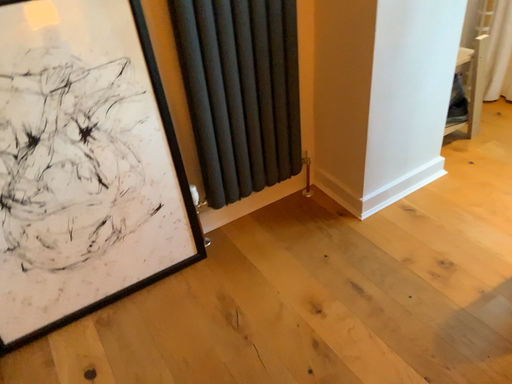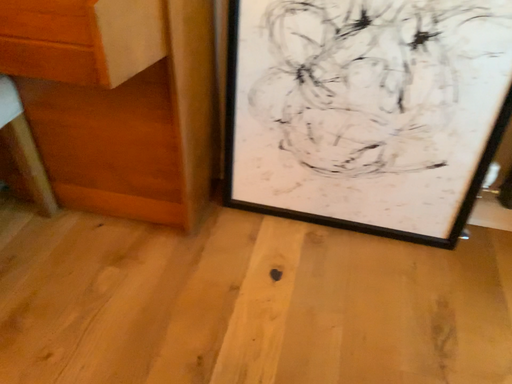
Question: Which way did the camera rotate in the video?

Choices:
 (A) rotated left
 (B) rotated right

Answer: (A)